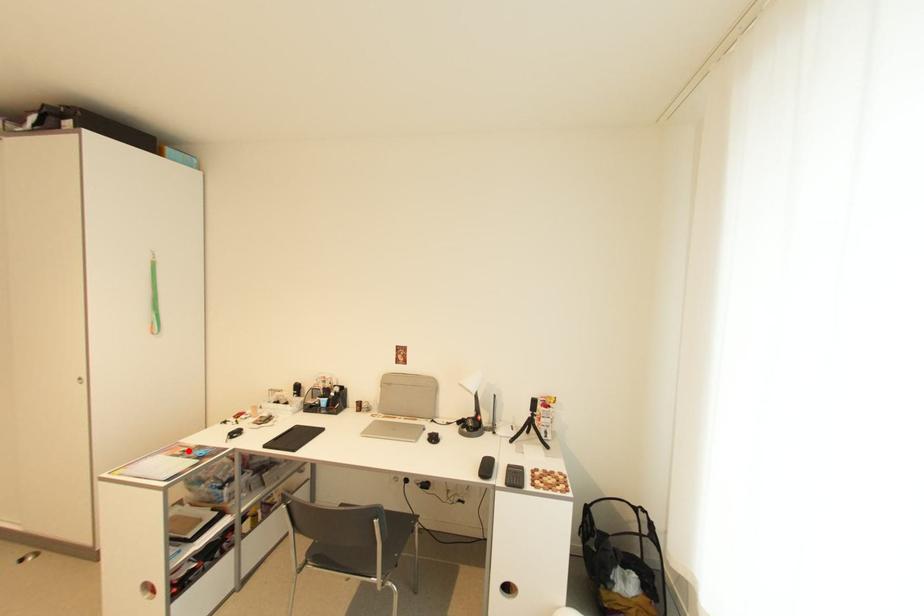
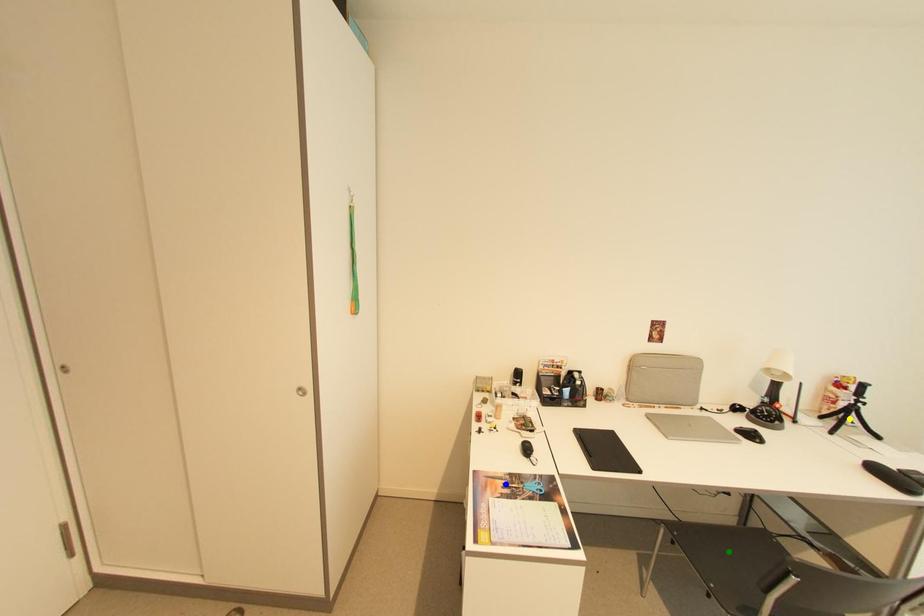
Question: I am providing you with two images of the same scene from different viewpoints. A red point is marked on the first image. You are given multiple points on the second image. Which mark in image 2 goes with the point in image 1?

Choices:
 (A) yellow point
 (B) green point
 (C) blue point

Answer: (C)